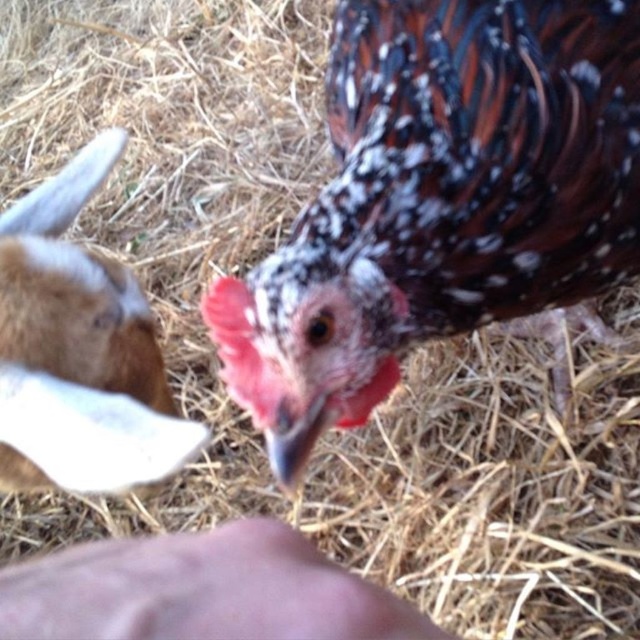
Which is above, speckled feathered chicken at center or brown woolen goat at left?

speckled feathered chicken at center is above.

Based on the photo, can you confirm if speckled feathered chicken at center is shorter than brown woolen goat at left?

No, speckled feathered chicken at center is not shorter than brown woolen goat at left.

Where is `speckled feathered chicken at center`? The width and height of the screenshot is (640, 640). speckled feathered chicken at center is located at coordinates (442, 205).